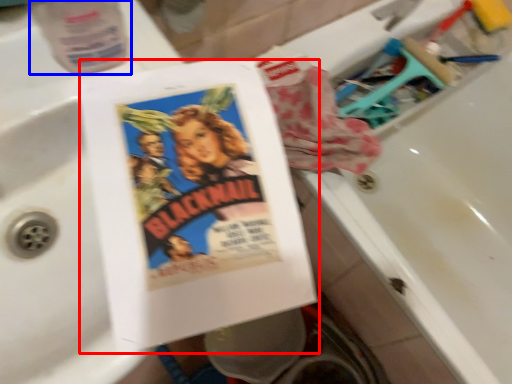
Question: Which object is closer to the camera taking this photo, paperback book (highlighted by a red box) or bottle (highlighted by a blue box)?

Choices:
 (A) paperback book
 (B) bottle

Answer: (A)